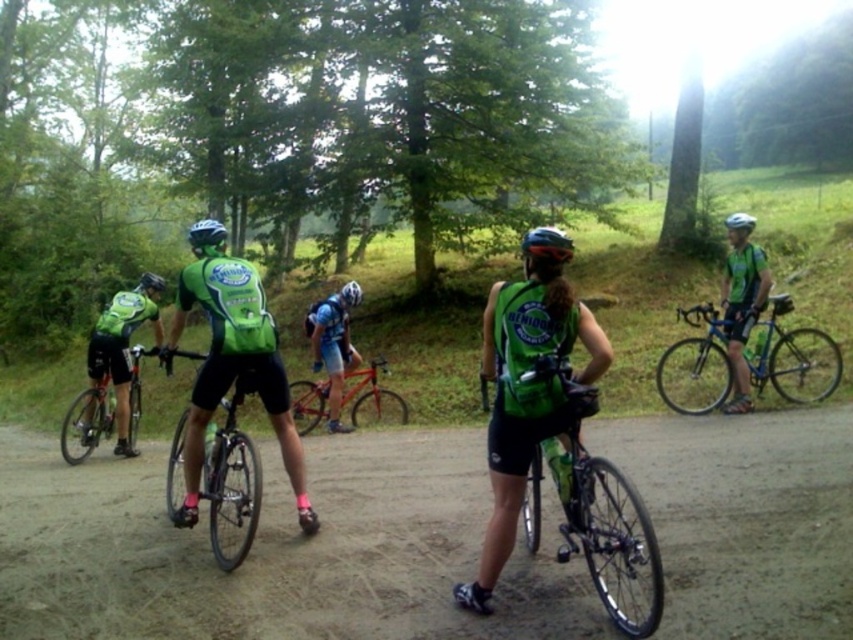
In the scene shown: Does dirt track at center have a greater height compared to shiny silver bicycle at left?

No, dirt track at center is not taller than shiny silver bicycle at left.

Looking at this image, which is more to the right, dirt track at center or shiny silver bicycle at left?

dirt track at center

Is point (259, 637) in front of point (103, 413)?

Yes, it is.

At what (x,y) coordinates should I click in order to perform the action: click on dirt track at center. Please return your answer as a coordinate pair (x, y). This screenshot has width=853, height=640. Looking at the image, I should click on (276, 548).

Can you confirm if shiny blue frame at right is shorter than shiny orange frame at center?

Incorrect, shiny blue frame at right's height does not fall short of shiny orange frame at center's.

What do you see at coordinates (795, 358) in the screenshot? This screenshot has width=853, height=640. I see `shiny blue frame at right` at bounding box center [795, 358].

Locate an element on the screen. shiny blue frame at right is located at coordinates (795, 358).

Can you confirm if green matte jersey at center is positioned above shiny black bicycle at center?

Indeed, green matte jersey at center is positioned over shiny black bicycle at center.

Is green matte jersey at center to the left of shiny black bicycle at center from the viewer's perspective?

Indeed, green matte jersey at center is positioned on the left side of shiny black bicycle at center.

Between point (184, 289) and point (204, 477), which one is positioned in front?

Positioned in front is point (184, 289).

The height and width of the screenshot is (640, 853). Identify the location of green matte jersey at center. (234, 368).